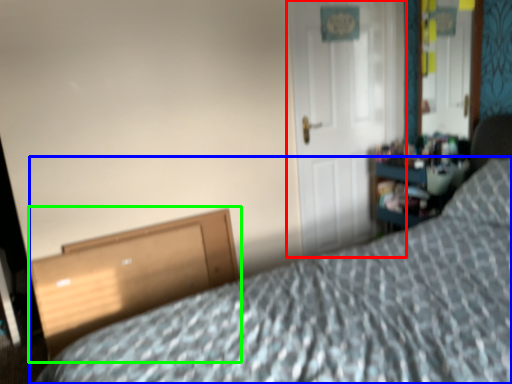
Question: Which object is the closest to the door (highlighted by a red box)? Choose among these: bed (highlighted by a blue box) or file cabinet (highlighted by a green box).

Choices:
 (A) bed
 (B) file cabinet

Answer: (B)